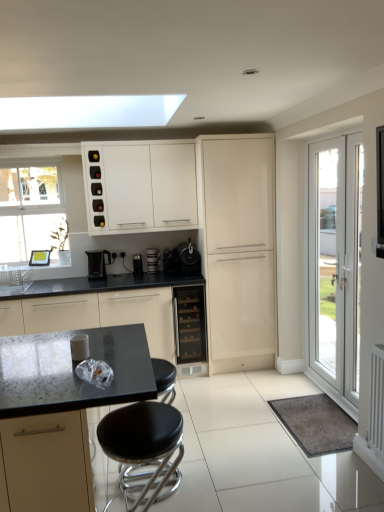
Measure the distance between point (x=181, y=243) and camera.

The distance of point (x=181, y=243) from camera is 4.13 meters.

Where is `white plastic sink at upper left`? white plastic sink at upper left is located at coordinates (15, 281).

How much space does white glossy wine rack at upper center, which is counted as the first cabinetry, starting from the back, occupy vertically?

The height of white glossy wine rack at upper center, which is counted as the first cabinetry, starting from the back, is 80.39 centimeters.

Where is `white glossy wine rack at upper center, which is counted as the first cabinetry, starting from the back`? The image size is (384, 512). white glossy wine rack at upper center, which is counted as the first cabinetry, starting from the back is located at coordinates (140, 187).

The height and width of the screenshot is (512, 384). What do you see at coordinates (143, 438) in the screenshot?
I see `black leather stool at center` at bounding box center [143, 438].

At what (x,y) coordinates should I click in order to perform the action: click on matte cream cabinet at center, the second cabinetry viewed from the back. Please return your answer as a coordinate pair (x, y). Looking at the image, I should click on (240, 251).

The width and height of the screenshot is (384, 512). In order to click on black matte coffee maker at center, which is the first appliance in right-to-left order in this screenshot , I will do `click(189, 258)`.

Considering the relative sizes of black plastic kettle at center and metallic black coffee maker at center, the first appliance viewed from the left, in the image provided, is black plastic kettle at center taller than metallic black coffee maker at center, the first appliance viewed from the left,?

Yes.

Does black plastic kettle at center have a smaller size compared to metallic black coffee maker at center, which is counted as the 3th appliance, starting from the right?

No, black plastic kettle at center is not smaller than metallic black coffee maker at center, which is counted as the 3th appliance, starting from the right.

Locate an element on the screen. appliance behind the black plastic kettle at center is located at coordinates (137, 264).

Is metallic black coffee maker at center, which is counted as the 3th appliance, starting from the right, located within black plastic kettle at center?

That's incorrect, metallic black coffee maker at center, which is counted as the 3th appliance, starting from the right, is not inside black plastic kettle at center.

Locate an element on the screen. The width and height of the screenshot is (384, 512). kitchen appliance that is on the left side of metallic black coffee machine at center is located at coordinates (97, 263).

Who is taller, black plastic kettle at center or metallic black coffee machine at center?

black plastic kettle at center is taller.

Is black plastic kettle at center to the left of metallic black coffee machine at center from the viewer's perspective?

Yes.

From the image's perspective, is black plastic kettle at center over metallic black coffee machine at center?

Incorrect, from the image's perspective, black plastic kettle at center is lower than metallic black coffee machine at center.

In the scene shown: Is white glossy wine rack at upper center, which is counted as the 4th cabinetry, starting from the front, placed right next to black granite countertop at lower left, positioned as the 4th cabinetry in back-to-front order?

No, white glossy wine rack at upper center, which is counted as the 4th cabinetry, starting from the front, is not with black granite countertop at lower left, positioned as the 4th cabinetry in back-to-front order.

Which point is more distant from viewer, (108, 194) or (45, 482)?

Positioned behind is point (108, 194).

From the image's perspective, which cabinetry is the 3rd one above the black granite countertop at lower left, acting as the first cabinetry starting from the front? Please provide its 2D coordinates.

[(140, 187)]

Is metallic black coffee maker at center, the first appliance viewed from the left, at the back of black leather stool at center?

No.

Is black leather stool at center positioned before metallic black coffee maker at center, the first appliance viewed from the left?

Yes, black leather stool at center is in front of metallic black coffee maker at center, the first appliance viewed from the left.

From the image's perspective, between black leather stool at center and metallic black coffee maker at center, which is counted as the 3th appliance, starting from the right, who is located below?

black leather stool at center, from the image's perspective.

From a real-world perspective, is black leather stool at center positioned under metallic black coffee maker at center, which is counted as the 3th appliance, starting from the right, based on gravity?

Indeed, from a real-world perspective, black leather stool at center is positioned beneath metallic black coffee maker at center, which is counted as the 3th appliance, starting from the right.

From the image's perspective, is metallic black coffee machine at center positioned above or below metallic black coffee maker at center, which is counted as the 3th appliance, starting from the right?

Clearly, from the image's perspective, metallic black coffee machine at center is above metallic black coffee maker at center, which is counted as the 3th appliance, starting from the right.

Does metallic black coffee machine at center appear on the left side of metallic black coffee maker at center, which is counted as the 3th appliance, starting from the right?

No, metallic black coffee machine at center is not to the left of metallic black coffee maker at center, which is counted as the 3th appliance, starting from the right.

From a real-world perspective, which is physically below, metallic black coffee machine at center or metallic black coffee maker at center, the first appliance viewed from the left?

metallic black coffee maker at center, the first appliance viewed from the left, is physically lower.

Is white plastic sink at upper left smaller than white glossy door at right?

Yes.

In terms of width, does white plastic sink at upper left look wider or thinner when compared to white glossy door at right?

white plastic sink at upper left is wider than white glossy door at right.

Considering the points (2, 282) and (341, 240), which point is in front, point (2, 282) or point (341, 240)?

Point (341, 240)

Would you say black granite countertop at lower left, acting as the second cabinetry starting from the front, is a long distance from black granite countertop at lower left, acting as the first cabinetry starting from the front?

Yes, black granite countertop at lower left, acting as the second cabinetry starting from the front, and black granite countertop at lower left, acting as the first cabinetry starting from the front, are quite far apart.

Is black granite countertop at lower left, acting as the second cabinetry starting from the front, wider or thinner than black granite countertop at lower left, positioned as the 4th cabinetry in back-to-front order?

Considering their sizes, black granite countertop at lower left, acting as the second cabinetry starting from the front, looks slimmer than black granite countertop at lower left, positioned as the 4th cabinetry in back-to-front order.

Can you confirm if black granite countertop at lower left, the third cabinetry in the back-to-front sequence, is taller than black granite countertop at lower left, acting as the first cabinetry starting from the front?

In fact, black granite countertop at lower left, the third cabinetry in the back-to-front sequence, may be shorter than black granite countertop at lower left, acting as the first cabinetry starting from the front.

Consider the image. How far apart are black granite countertop at lower left, the third cabinetry in the back-to-front sequence, and black granite countertop at lower left, acting as the first cabinetry starting from the front?

black granite countertop at lower left, the third cabinetry in the back-to-front sequence, is 1.74 meters away from black granite countertop at lower left, acting as the first cabinetry starting from the front.

Locate an element on the screen. The width and height of the screenshot is (384, 512). appliance behind the black plastic kettle at center is located at coordinates (137, 264).

Where is `coffee machine lying on the right of black plastic kettle at center`? This screenshot has height=512, width=384. coffee machine lying on the right of black plastic kettle at center is located at coordinates (153, 260).

Estimate the real-world distances between objects in this image. Which object is closer to white glossy door at right, matte cream cabinet at center, the second cabinetry viewed from the back, or metallic black coffee machine at center?

matte cream cabinet at center, the second cabinetry viewed from the back, is closer to white glossy door at right.

Considering their positions, is black plastic coffee maker at center, placed as the 2th appliance when sorted from left to right, positioned closer to black plastic kettle at center than white plastic sink at upper left?

white plastic sink at upper left lies closer to black plastic kettle at center than the other object.

When comparing their distances from white glossy door at right, does black granite countertop at lower left, positioned as the 4th cabinetry in back-to-front order, or matte cream cabinet at center, which ranks as the third cabinetry in front-to-back order, seem further?

Based on the image, black granite countertop at lower left, positioned as the 4th cabinetry in back-to-front order, appears to be further to white glossy door at right.

Estimate the real-world distances between objects in this image. Which object is further from black leather stool at center, black glass wine cooler at center or white glossy wine rack at upper center, which is counted as the first cabinetry, starting from the back?

white glossy wine rack at upper center, which is counted as the first cabinetry, starting from the back, lies further to black leather stool at center than the other object.

In the scene shown: From the image, which object appears to be nearer to black glass wine cooler at center, black matte coffee maker at center, which is the first appliance in right-to-left order, or black plastic kettle at center?

black matte coffee maker at center, which is the first appliance in right-to-left order, is closer to black glass wine cooler at center.

Estimate the real-world distances between objects in this image. Which object is closer to matte cream cabinet at center, which ranks as the third cabinetry in front-to-back order, black granite countertop at lower left, acting as the first cabinetry starting from the front, or black glass wine cooler at center?

Among the two, black glass wine cooler at center is located nearer to matte cream cabinet at center, which ranks as the third cabinetry in front-to-back order.

Which object lies further to the anchor point metallic black coffee machine at center, matte cream cabinet at center, the second cabinetry viewed from the back, or white glossy door at right?

white glossy door at right lies further to metallic black coffee machine at center than the other object.

Considering their positions, is matte cream cabinet at center, which ranks as the third cabinetry in front-to-back order, positioned further to black granite countertop at lower left, acting as the second cabinetry starting from the front, than black plastic coffee maker at center, placed as the 2th appliance when sorted from left to right?

Among the two, matte cream cabinet at center, which ranks as the third cabinetry in front-to-back order, is located further to black granite countertop at lower left, acting as the second cabinetry starting from the front.

Locate an element on the screen. The height and width of the screenshot is (512, 384). sink between black granite countertop at lower left, acting as the first cabinetry starting from the front, and black matte coffee maker at center, the third appliance in the left-to-right sequence, in the front-back direction is located at coordinates (15, 281).

Locate an element on the screen. The height and width of the screenshot is (512, 384). coffee machine between white plastic sink at upper left and black plastic coffee maker at center, marked as the 2th appliance in a right-to-left arrangement, in the horizontal direction is located at coordinates (153, 260).

Image resolution: width=384 pixels, height=512 pixels. Find the location of `appliance located between black plastic kettle at center and metallic black coffee machine at center in the left-right direction`. appliance located between black plastic kettle at center and metallic black coffee machine at center in the left-right direction is located at coordinates (137, 264).

Where is `stool positioned between black granite countertop at lower left, positioned as the 4th cabinetry in back-to-front order, and black plastic coffee maker at center, placed as the 2th appliance when sorted from left to right, from near to far`? The width and height of the screenshot is (384, 512). stool positioned between black granite countertop at lower left, positioned as the 4th cabinetry in back-to-front order, and black plastic coffee maker at center, placed as the 2th appliance when sorted from left to right, from near to far is located at coordinates (143, 438).